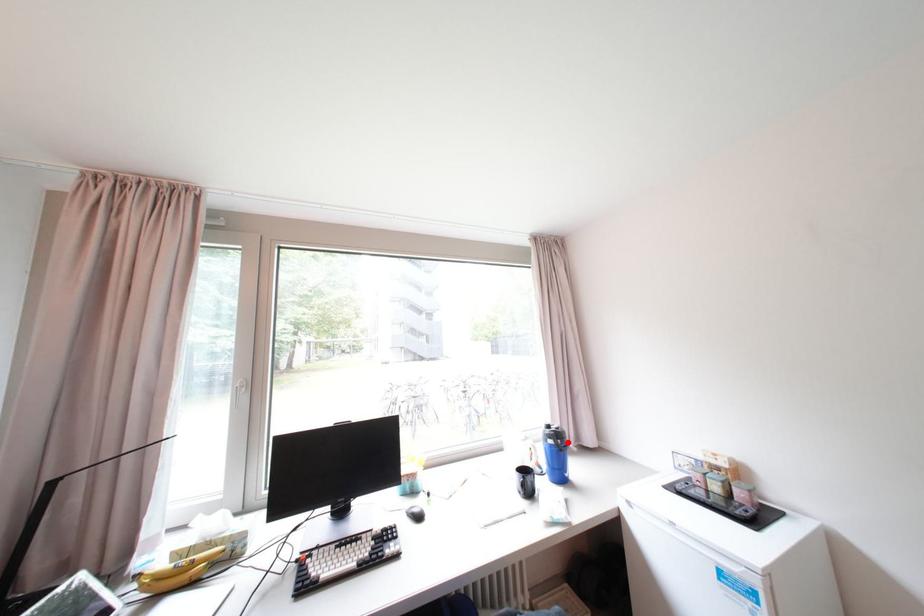
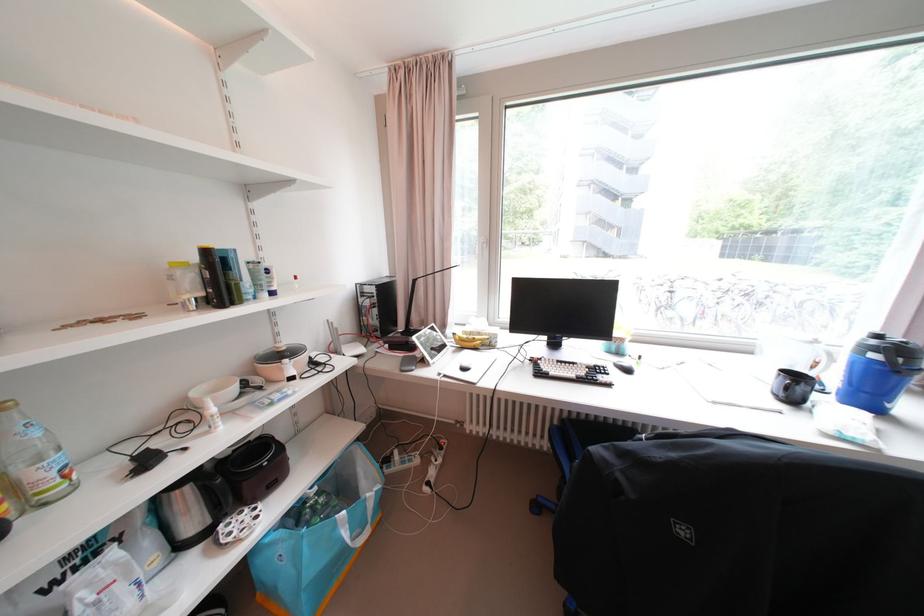
Question: A red point is marked in image1. In image2, is the corresponding 3D point closer to the camera or farther? Reply with the corresponding letter.

Choices:
 (A) The corresponding 3D point is closer.
 (B) The corresponding 3D point is farther.

Answer: (A)